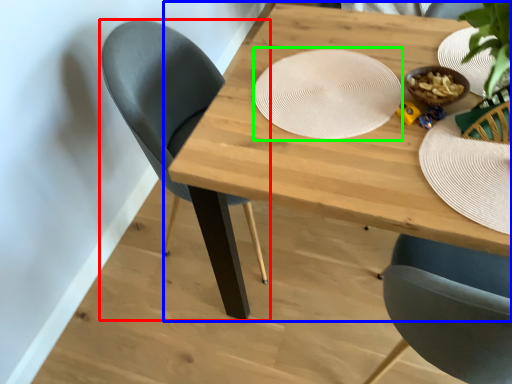
Question: Considering the real-world distances, which object is farthest from chair (highlighted by a red box)? table (highlighted by a blue box) or platter (highlighted by a green box)?

Choices:
 (A) table
 (B) platter

Answer: (B)